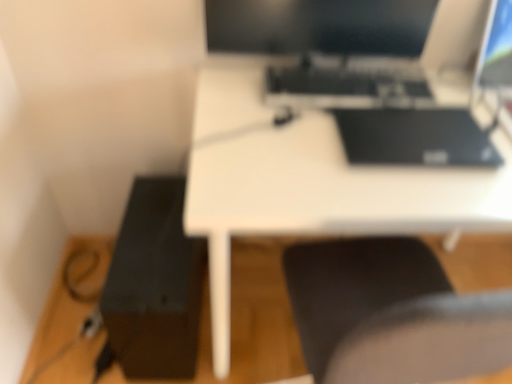
Question: From their relative heights in the image, would you say black glossy monitor at upper center is taller or shorter than black matte printer at lower left?

Choices:
 (A) tall
 (B) short

Answer: (B)

Question: Is point [435, 1] positioned closer to the camera than point [152, 297]?

Choices:
 (A) closer
 (B) farther

Answer: (A)

Question: Which object is positioned farthest from the black glossy monitor at upper center?

Choices:
 (A) matte black monitor at upper right
 (B) black matte keyboard at center
 (C) black matte printer at lower left
 (D) white matte desk at center

Answer: (C)

Question: Estimate the real-world distances between objects in this image. Which object is closer to the white matte desk at center?

Choices:
 (A) black matte keyboard at center
 (B) black glossy monitor at upper center
 (C) black matte printer at lower left
 (D) matte black monitor at upper right

Answer: (A)